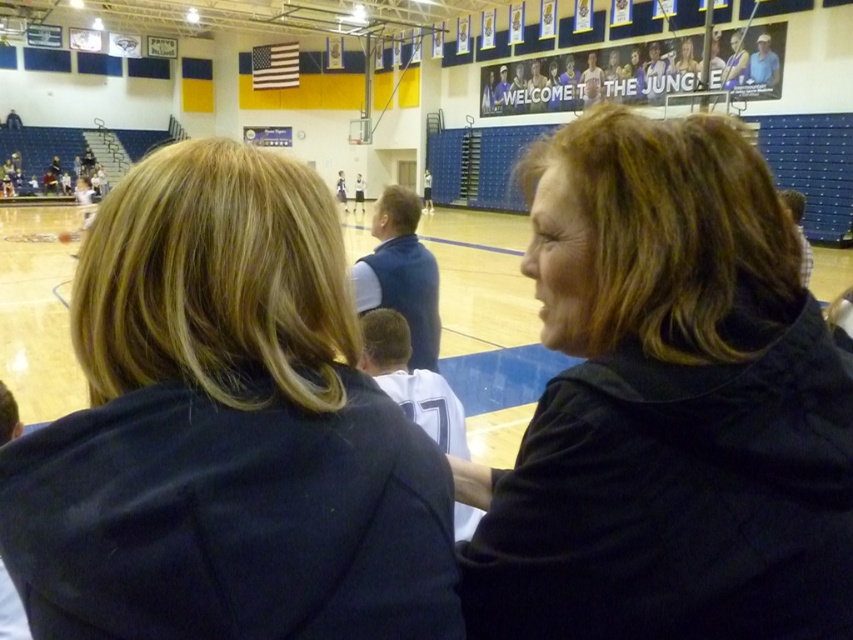
Question: Which point is closer to the camera?

Choices:
 (A) (805, 472)
 (B) (196, 221)
 (C) (752, 45)

Answer: (A)

Question: Is dark blue jacket at upper left bigger than black matte jacket at center?

Choices:
 (A) no
 (B) yes

Answer: (B)

Question: Which point is closer to the camera?

Choices:
 (A) (158, 552)
 (B) (775, 232)
 (C) (679, 88)

Answer: (A)

Question: Estimate the real-world distances between objects in this image. Which object is closer to the black matte jacket at center?

Choices:
 (A) blue jersey at upper center
 (B) dark blue jacket at upper left

Answer: (B)

Question: Does dark blue jacket at upper left come in front of blue jersey at upper center?

Choices:
 (A) no
 (B) yes

Answer: (B)

Question: Is dark blue jacket at upper left above black matte jacket at center?

Choices:
 (A) yes
 (B) no

Answer: (A)